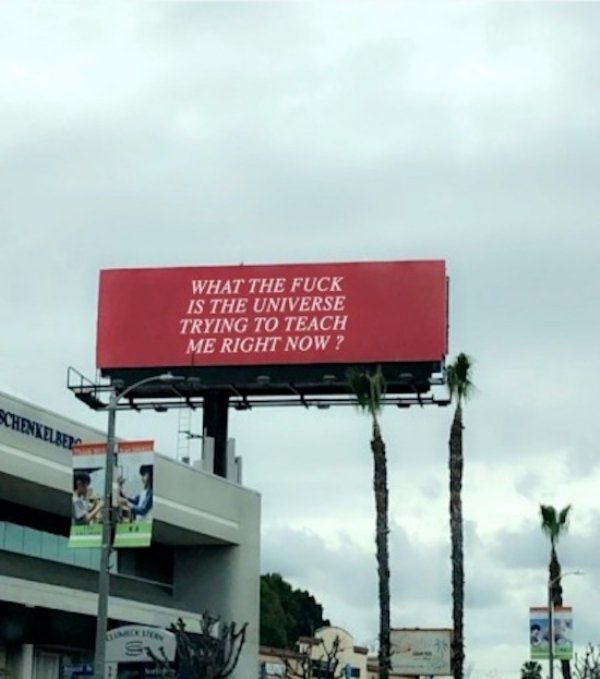
Where is `ladder`? This screenshot has width=600, height=679. ladder is located at coordinates (182, 441).